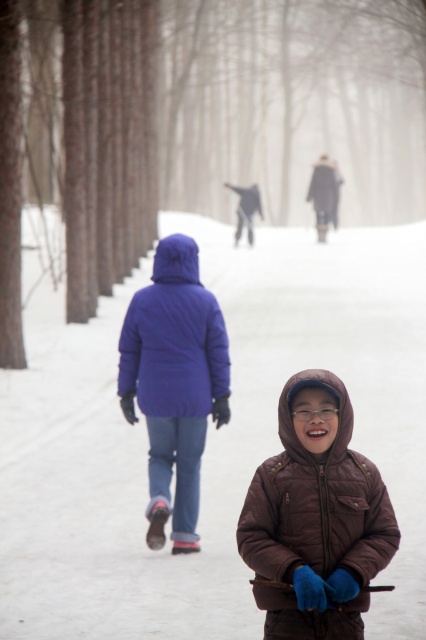
Who is positioned more to the left, brown quilted jacket at center or matte blue jacket at center?

matte blue jacket at center

From the picture: Can you confirm if brown quilted jacket at center is positioned above matte blue jacket at center?

No.

The height and width of the screenshot is (640, 426). What do you see at coordinates (316, 516) in the screenshot?
I see `brown quilted jacket at center` at bounding box center [316, 516].

Where is `brown quilted jacket at center`? The image size is (426, 640). brown quilted jacket at center is located at coordinates (316, 516).